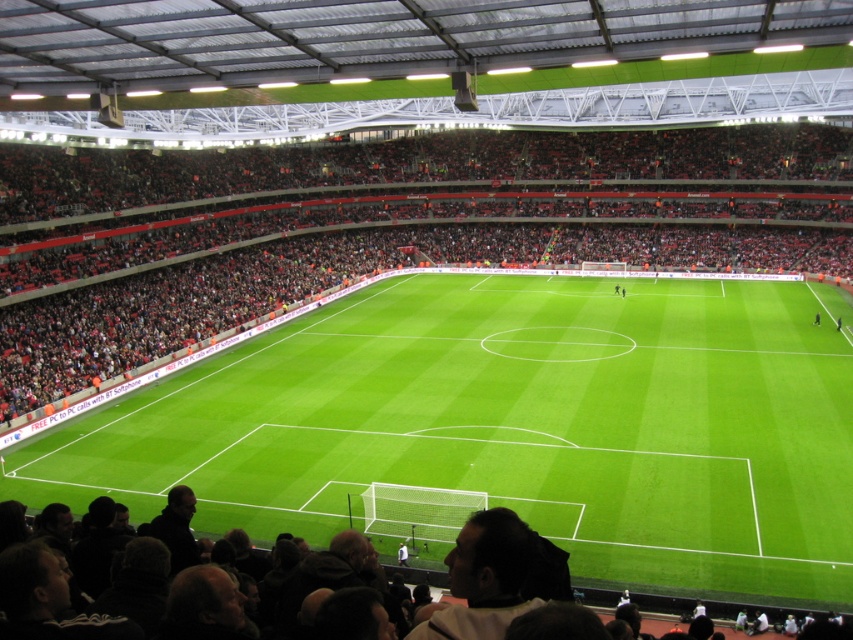
Question: Among these objects, which one is nearest to the camera?

Choices:
 (A) red plastic seats at upper center
 (B) green grass football field at center
 (C) dark brown leather jacket at lower center

Answer: (C)

Question: Can you confirm if green grass football field at center is smaller than red plastic seats at upper center?

Choices:
 (A) yes
 (B) no

Answer: (A)

Question: Is green grass football field at center to the left of red plastic seats at upper center from the viewer's perspective?

Choices:
 (A) no
 (B) yes

Answer: (B)

Question: Which object is the farthest from the dark brown leather jacket at lower center?

Choices:
 (A) red plastic seats at upper center
 (B) green grass football field at center

Answer: (A)

Question: Does green grass football field at center lie in front of dark brown leather jacket at lower center?

Choices:
 (A) no
 (B) yes

Answer: (A)

Question: Which point is closer to the camera taking this photo?

Choices:
 (A) (650, 465)
 (B) (753, 561)
 (C) (323, 266)

Answer: (B)